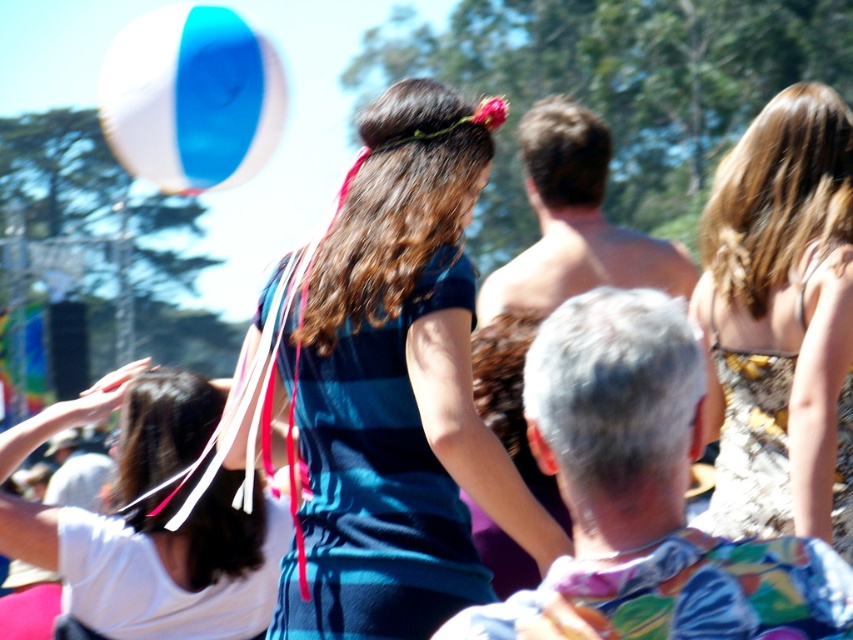
Question: Which object is positioned closest to the brown textured dress at center?

Choices:
 (A) blue/white beach ball at upper left
 (B) blue striped shirt at center
 (C) white fabric headband at upper left

Answer: (B)

Question: From the image, what is the correct spatial relationship of blue striped shirt at center in relation to brown textured dress at center?

Choices:
 (A) right
 (B) left

Answer: (B)

Question: Based on their relative distances, which object is nearer to the brown textured dress at center?

Choices:
 (A) blue/white beach ball at upper left
 (B) blue striped shirt at center
 (C) white fabric headband at upper left

Answer: (B)

Question: Is brown textured dress at center to the right of blue/white beach ball at upper left from the viewer's perspective?

Choices:
 (A) no
 (B) yes

Answer: (B)

Question: Estimate the real-world distances between objects in this image. Which object is farther from the white fabric headband at upper left?

Choices:
 (A) brown textured dress at center
 (B) blue striped shirt at center

Answer: (A)

Question: Is brown textured dress at center to the left of white fabric headband at upper left from the viewer's perspective?

Choices:
 (A) no
 (B) yes

Answer: (A)